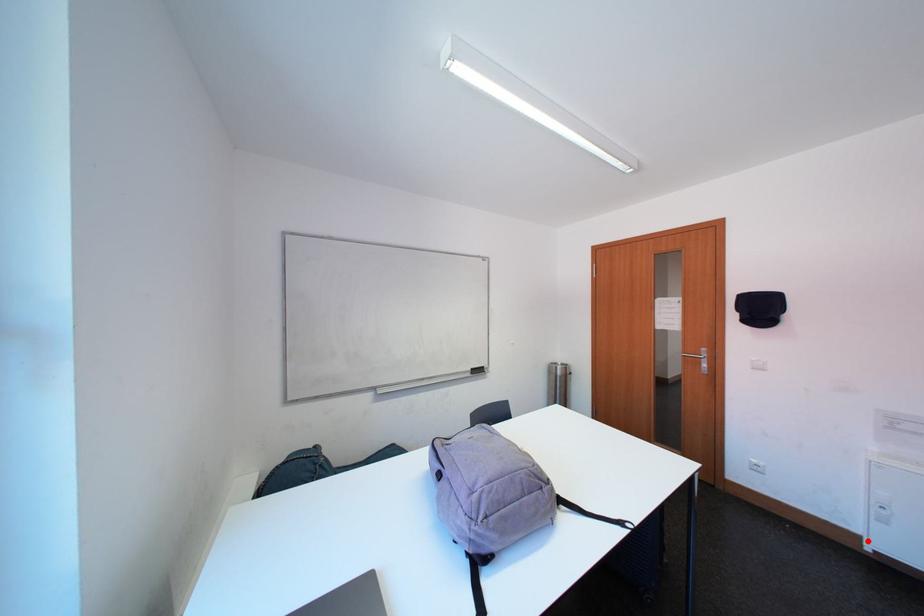
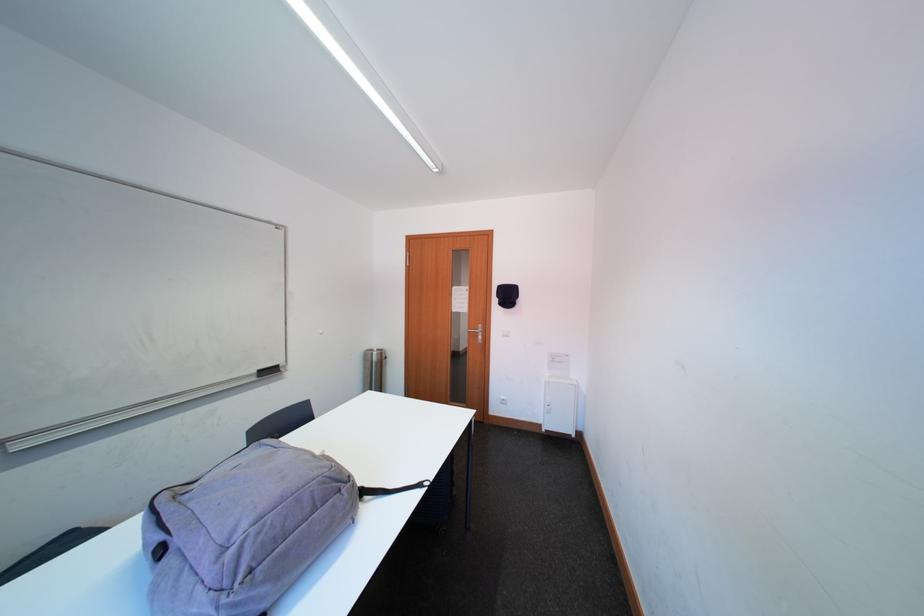
Question: I am providing you with two images of the same scene from different viewpoints. In image1, a red point is highlighted. Considering the same 3D point in image2, which of the following is correct?

Choices:
 (A) It is closer
 (B) It is farther

Answer: (B)